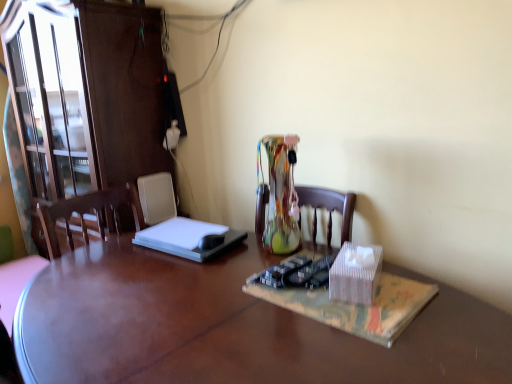
Identify the location of free space in front of translucent plastic book at center. click(357, 351).